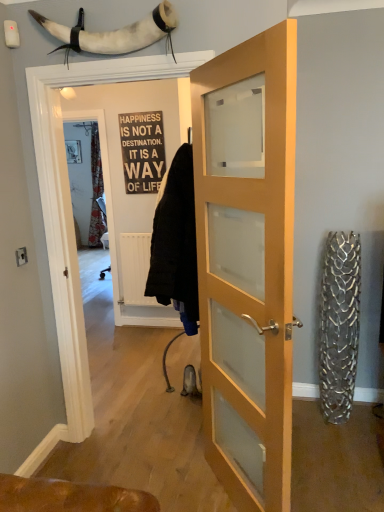
Question: Are white horn at upper center and light wood/glass door at center making contact?

Choices:
 (A) no
 (B) yes

Answer: (A)

Question: Would you say white horn at upper center is a long distance from light wood/glass door at center?

Choices:
 (A) no
 (B) yes

Answer: (A)

Question: Considering the relative sizes of white horn at upper center and light wood/glass door at center in the image provided, is white horn at upper center smaller than light wood/glass door at center?

Choices:
 (A) no
 (B) yes

Answer: (B)

Question: Considering the relative sizes of white horn at upper center and light wood/glass door at center in the image provided, is white horn at upper center bigger than light wood/glass door at center?

Choices:
 (A) no
 (B) yes

Answer: (A)

Question: Is white horn at upper center in front of light wood/glass door at center?

Choices:
 (A) no
 (B) yes

Answer: (A)

Question: Is white horn at upper center further to camera compared to light wood/glass door at center?

Choices:
 (A) no
 (B) yes

Answer: (B)

Question: Can you confirm if black wood sign at center is bigger than light wood/glass door at center?

Choices:
 (A) yes
 (B) no

Answer: (B)

Question: Can you confirm if black wood sign at center is smaller than light wood/glass door at center?

Choices:
 (A) no
 (B) yes

Answer: (B)

Question: Is black wood sign at center closer to camera compared to light wood/glass door at center?

Choices:
 (A) no
 (B) yes

Answer: (A)

Question: Can you confirm if black wood sign at center is thinner than light wood/glass door at center?

Choices:
 (A) no
 (B) yes

Answer: (B)

Question: From the image's perspective, would you say black wood sign at center is shown under light wood/glass door at center?

Choices:
 (A) no
 (B) yes

Answer: (A)

Question: From the image's perspective, is black wood sign at center on light wood/glass door at center?

Choices:
 (A) no
 (B) yes

Answer: (B)

Question: Does light wood/glass door at center touch white horn at upper center?

Choices:
 (A) yes
 (B) no

Answer: (B)